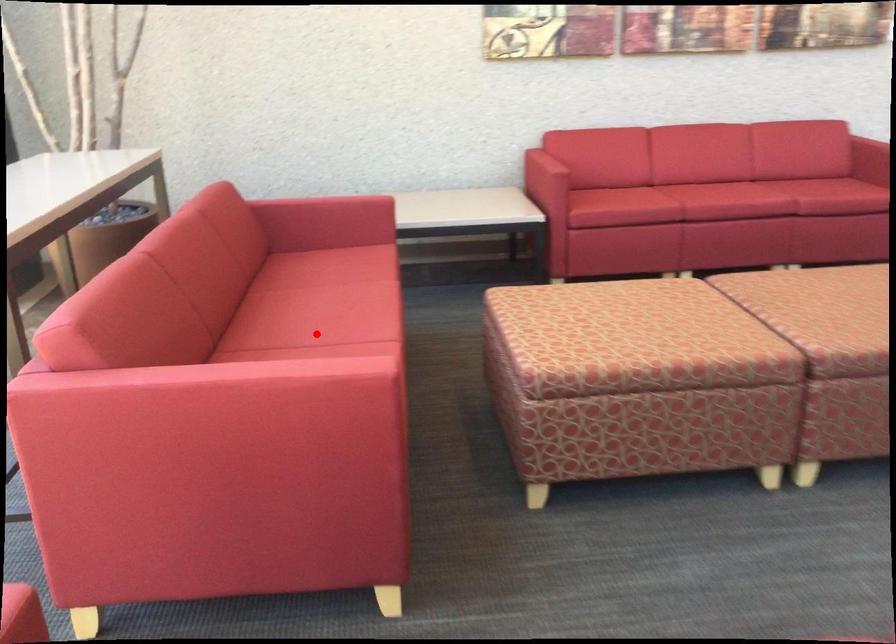
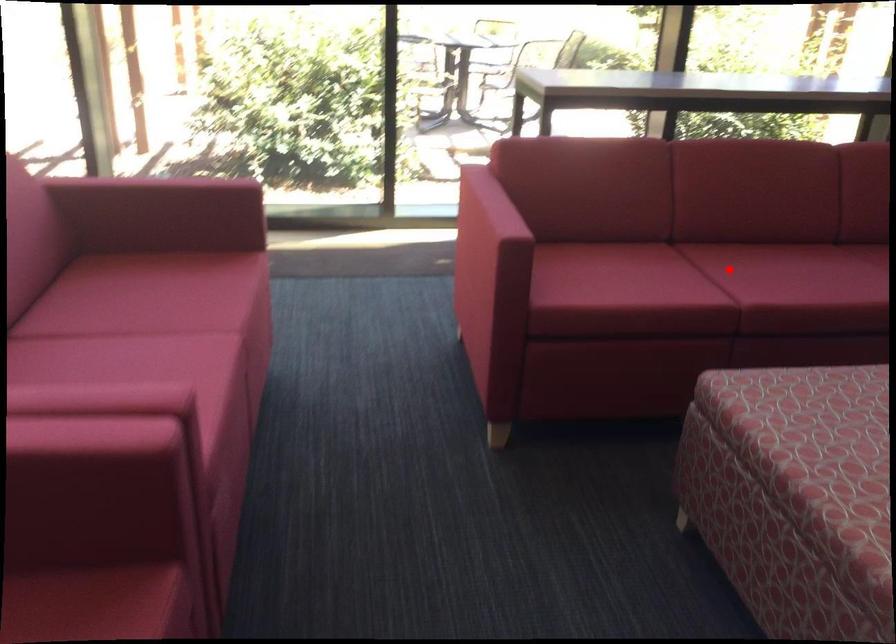
I am providing you with two images of the same scene from different viewpoints. A red point is marked on the first image and another point is marked on the second image. Do the highlighted points in image1 and image2 indicate the same real-world spot?

Yes